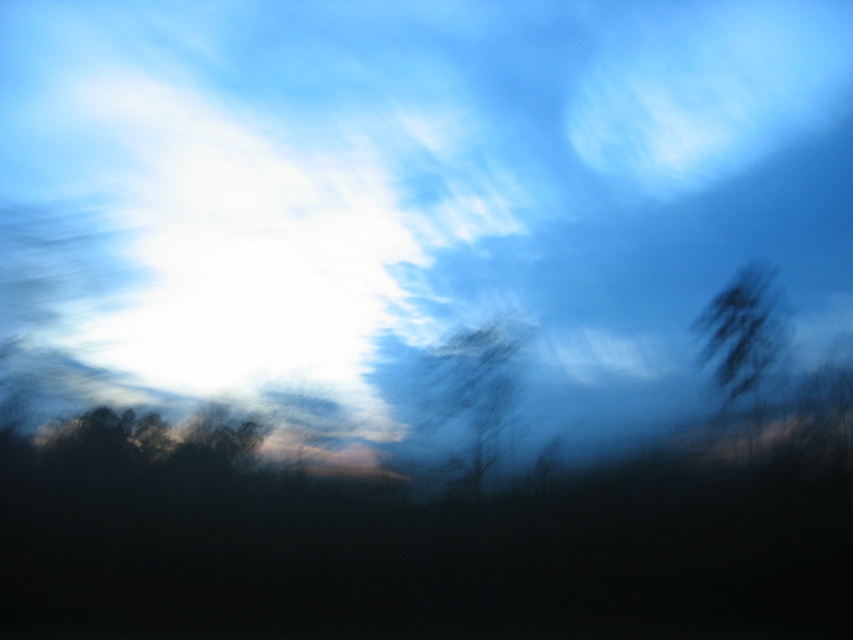
Question: Can you confirm if white fluffy cloud at upper center is wider than dark brown textured tree at center?

Choices:
 (A) yes
 (B) no

Answer: (A)

Question: Does white fluffy cloud at upper center have a larger size compared to dark green textured tree at right?

Choices:
 (A) no
 (B) yes

Answer: (B)

Question: Based on their relative distances, which object is nearer to the dark green textured tree at right?

Choices:
 (A) dark brown textured tree at center
 (B) white fluffy cloud at upper center

Answer: (B)

Question: Based on their relative distances, which object is nearer to the dark green textured tree at right?

Choices:
 (A) dark brown textured tree at center
 (B) white fluffy cloud at upper center

Answer: (B)

Question: Can you confirm if white fluffy cloud at upper center is positioned below dark brown textured tree at center?

Choices:
 (A) yes
 (B) no

Answer: (B)

Question: Which point appears farthest from the camera in this image?

Choices:
 (A) (337, 200)
 (B) (432, 388)
 (C) (756, 328)

Answer: (A)